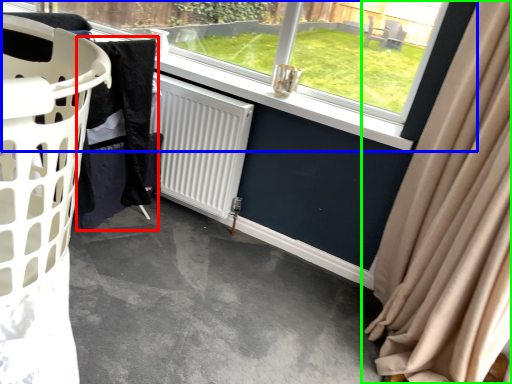
Question: Based on their relative distances, which object is nearer to clothing (highlighted by a red box)? Choose from window (highlighted by a blue box) and curtain (highlighted by a green box).

Choices:
 (A) window
 (B) curtain

Answer: (A)